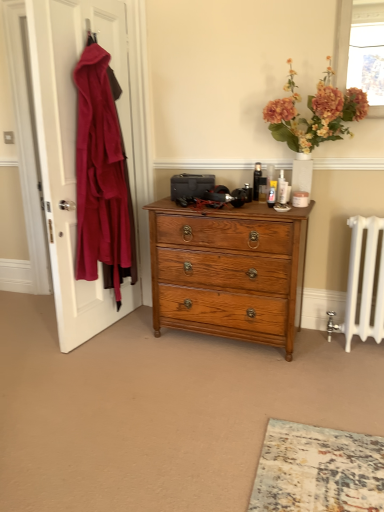
Question: Should I look upward or downward to see translucent glass window screen at upper right?

Choices:
 (A) down
 (B) up

Answer: (B)

Question: From the image's perspective, is shiny oak chest of drawers at center located beneath matte orange flowers at upper right?

Choices:
 (A) yes
 (B) no

Answer: (A)

Question: From a real-world perspective, is shiny oak chest of drawers at center beneath matte orange flowers at upper right?

Choices:
 (A) yes
 (B) no

Answer: (A)

Question: Is shiny oak chest of drawers at center further to camera compared to matte orange flowers at upper right?

Choices:
 (A) yes
 (B) no

Answer: (A)

Question: Does shiny oak chest of drawers at center have a larger size compared to matte orange flowers at upper right?

Choices:
 (A) yes
 (B) no

Answer: (A)

Question: From a real-world perspective, is shiny oak chest of drawers at center over matte orange flowers at upper right?

Choices:
 (A) yes
 (B) no

Answer: (B)

Question: Can you confirm if shiny oak chest of drawers at center is taller than matte orange flowers at upper right?

Choices:
 (A) yes
 (B) no

Answer: (A)

Question: From the image's perspective, does velvet red coat at left appear lower than matte orange flowers at upper right?

Choices:
 (A) no
 (B) yes

Answer: (B)

Question: Does velvet red coat at left appear on the right side of matte orange flowers at upper right?

Choices:
 (A) yes
 (B) no

Answer: (B)

Question: Can you confirm if velvet red coat at left is shorter than matte orange flowers at upper right?

Choices:
 (A) yes
 (B) no

Answer: (B)

Question: Can you confirm if velvet red coat at left is positioned to the left of matte orange flowers at upper right?

Choices:
 (A) yes
 (B) no

Answer: (A)

Question: Is there a large distance between velvet red coat at left and matte orange flowers at upper right?

Choices:
 (A) no
 (B) yes

Answer: (B)

Question: Does velvet red coat at left have a smaller size compared to matte orange flowers at upper right?

Choices:
 (A) yes
 (B) no

Answer: (B)

Question: Considering the relative positions of matte orange flowers at upper right and translucent glass window screen at upper right in the image provided, is matte orange flowers at upper right in front of translucent glass window screen at upper right?

Choices:
 (A) yes
 (B) no

Answer: (A)